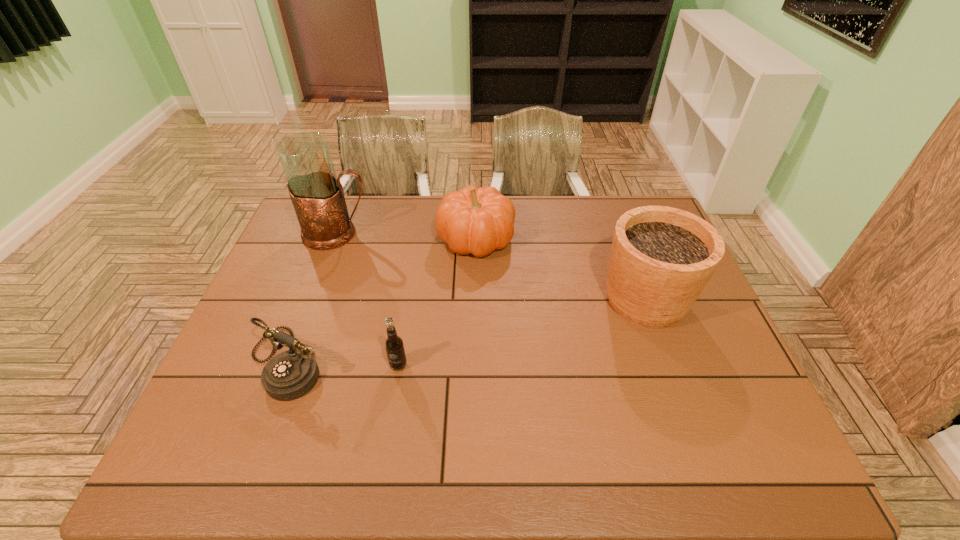
Where is `free region located on the right of the telephone`? free region located on the right of the telephone is located at coordinates (421, 361).

The height and width of the screenshot is (540, 960). Identify the location of pitcher situated at the far edge. (317, 195).

This screenshot has height=540, width=960. Identify the location of pumpkin that is at the far edge. [x=474, y=220].

Identify the location of pitcher that is at the left edge. (317, 195).

Where is `telephone positioned at the left edge`? The width and height of the screenshot is (960, 540). telephone positioned at the left edge is located at coordinates (289, 375).

You are a GUI agent. You are given a task and a screenshot of the screen. Output one action in this format:
    pyautogui.click(x=<x>, y=<y>)
    Task: Click on the object that is at the right edge
    This screenshot has width=960, height=540.
    Given the screenshot: What is the action you would take?
    pyautogui.click(x=661, y=259)

Find the location of a particular element. object situated at the far left corner is located at coordinates (317, 195).

Find the location of a particular element. vacant space at the far edge of the desktop is located at coordinates (579, 202).

This screenshot has width=960, height=540. In the image, there is a desktop. Identify the location of vacant space at the near edge. point(614,475).

This screenshot has height=540, width=960. I want to click on vacant space at the left edge of the desktop, so click(x=225, y=379).